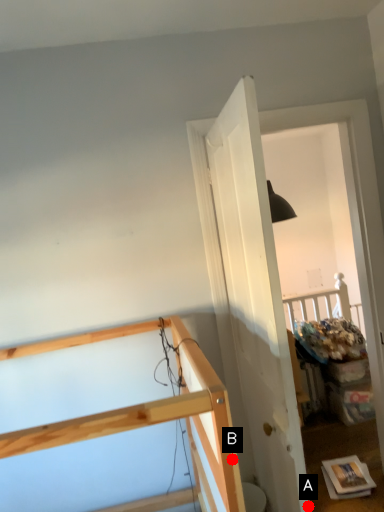
Question: Two points are circled on the image, labeled by A and B beside each circle. Which point is closer to the camera taking this photo?

Choices:
 (A) A is closer
 (B) B is closer

Answer: (B)